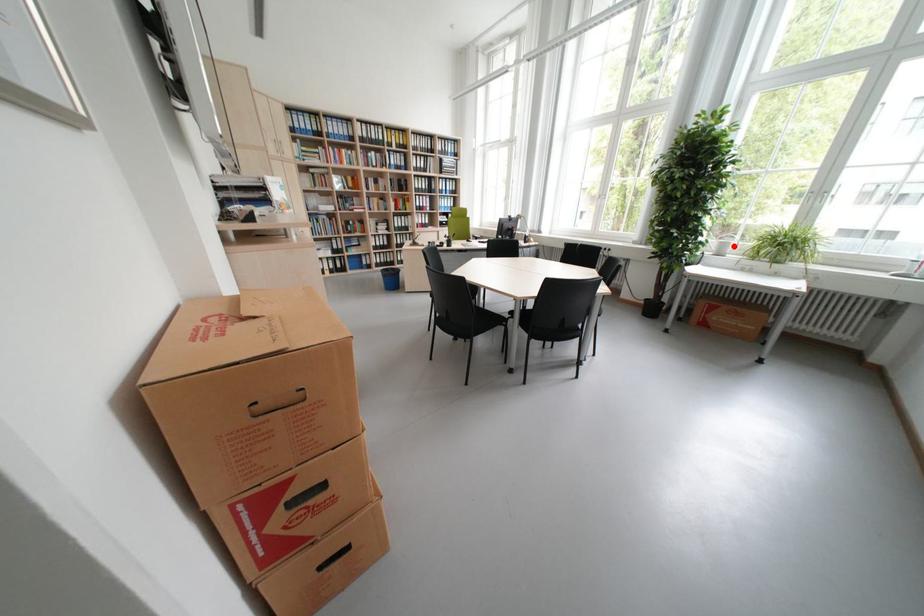
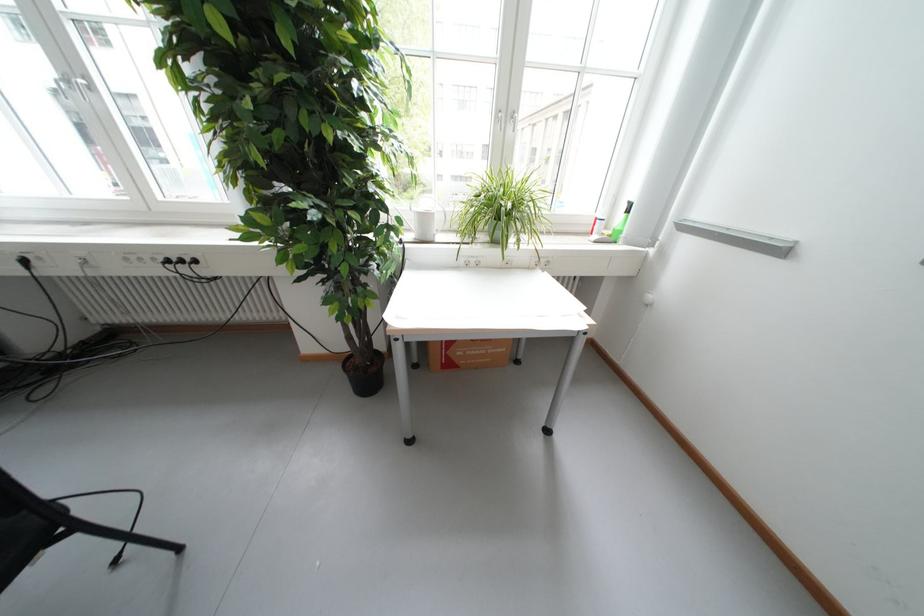
Locate, in the second image, the point that corresponds to the highlighted location in the first image.

(435, 220)